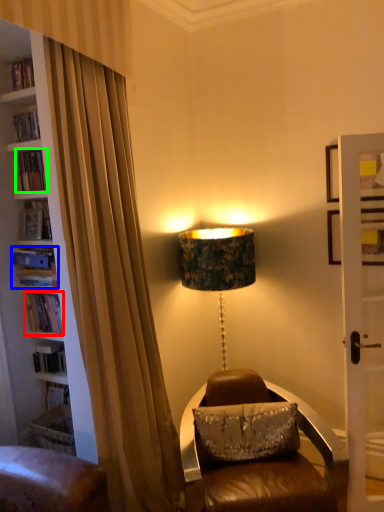
Question: Which object is positioned closest to book (highlighted by a red box)? Select from book (highlighted by a blue box) and book (highlighted by a green box).

Choices:
 (A) book
 (B) book

Answer: (A)